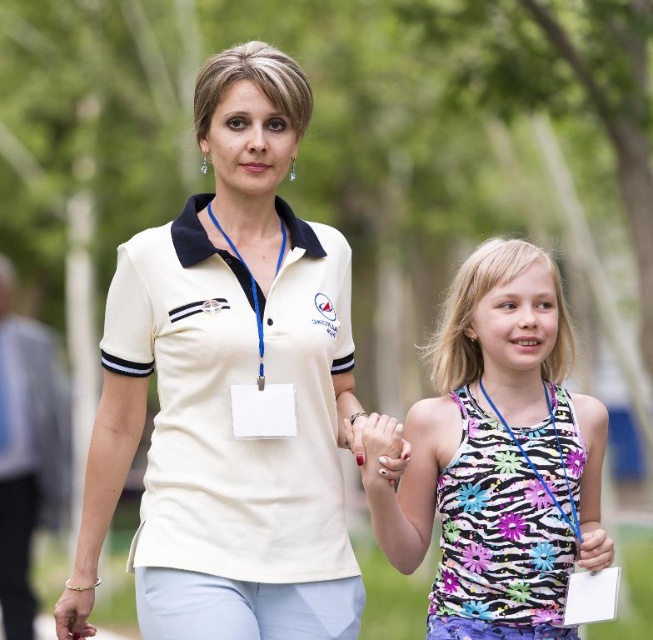
Question: Based on their relative distances, which object is nearer to the printed fabric tank top at center?

Choices:
 (A) white matte lanyard at left
 (B) white matte shirt at center

Answer: (B)

Question: Observing the image, what is the correct spatial positioning of white matte shirt at center in reference to white matte lanyard at left?

Choices:
 (A) above
 (B) below

Answer: (A)

Question: Which object is positioned closest to the printed fabric tank top at center?

Choices:
 (A) white matte lanyard at left
 (B) white matte shirt at center

Answer: (B)

Question: Is printed fabric tank top at center to the right of white matte lanyard at left from the viewer's perspective?

Choices:
 (A) no
 (B) yes

Answer: (B)

Question: Which point is farther to the camera?

Choices:
 (A) printed fabric tank top at center
 (B) white matte shirt at center
 (C) white matte lanyard at left

Answer: (C)

Question: Considering the relative positions of white matte shirt at center and printed fabric tank top at center in the image provided, where is white matte shirt at center located with respect to printed fabric tank top at center?

Choices:
 (A) above
 (B) below

Answer: (A)